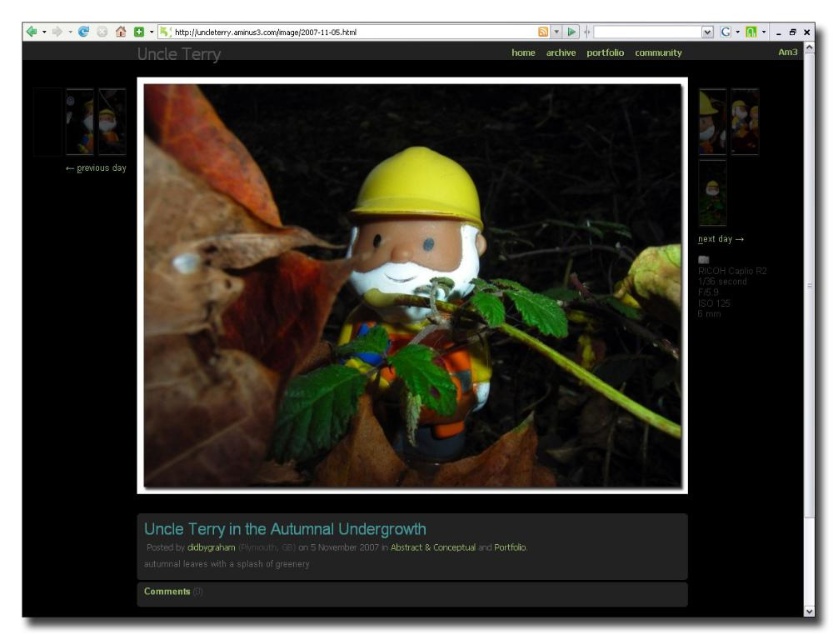
Question: Is green leafy plant at center below yellow matte plastic doll at center?

Choices:
 (A) yes
 (B) no

Answer: (B)

Question: Does green leafy plant at center have a larger size compared to yellow matte plastic doll at center?

Choices:
 (A) yes
 (B) no

Answer: (A)

Question: In this image, where is green leafy plant at center located relative to yellow matte plastic doll at center?

Choices:
 (A) right
 (B) left

Answer: (B)

Question: Which object is farther from the camera taking this photo?

Choices:
 (A) green leafy plant at center
 (B) yellow matte plastic doll at center

Answer: (B)

Question: Which of the following is the closest to the observer?

Choices:
 (A) green leafy plant at center
 (B) yellow matte plastic doll at center

Answer: (A)

Question: Which object is farther from the camera taking this photo?

Choices:
 (A) yellow matte plastic doll at center
 (B) green leafy plant at center

Answer: (A)